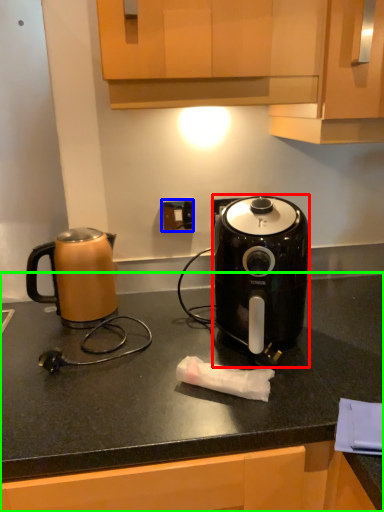
Question: Which object is the farthest from toaster (highlighted by a red box)? Choose among these: electric outlet (highlighted by a blue box) or countertop (highlighted by a green box).

Choices:
 (A) electric outlet
 (B) countertop

Answer: (A)